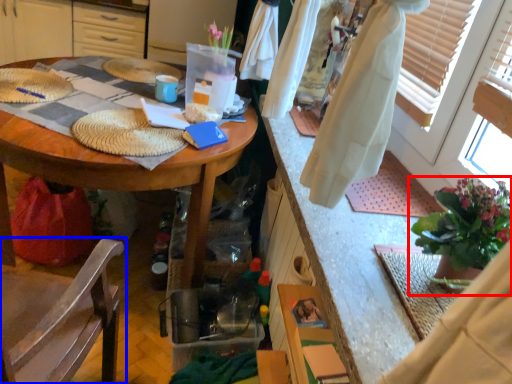
Question: Which point is further to the camera, houseplant (highlighted by a red box) or chair (highlighted by a blue box)?

Choices:
 (A) houseplant
 (B) chair

Answer: (A)